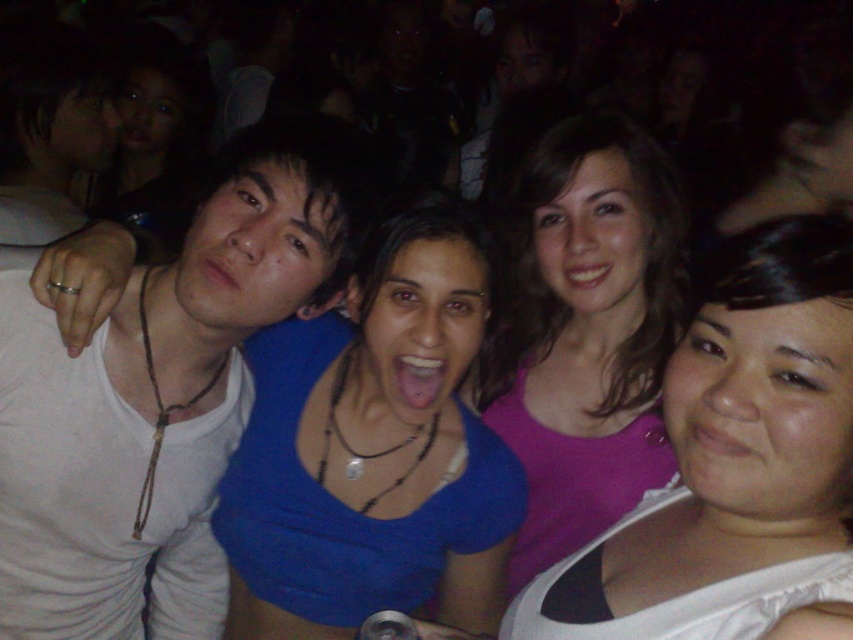
You are a photographer trying to adjust the spacing between the blue fabric top at center and the purple matte tank top at center for a group photo. The minimum required distance between subjects for clear focus is 10 inches. Can the current spacing between them work?

The distance between the blue fabric top at center and the purple matte tank top at center is 9.72 inches, which is slightly less than the required 10 inches. Therefore, the current spacing may not provide clear focus and needs adjustment.

You are a photographer trying to adjust the lighting for a group photo. You notice the blue fabric top at center and the purple matte tank top at center. Which top will require more downward adjustment of the lighting to avoid overexposure?

The blue fabric top at center is shorter than the purple matte tank top at center, so the blue fabric top at center will require more downward adjustment of the lighting to avoid overexposure.